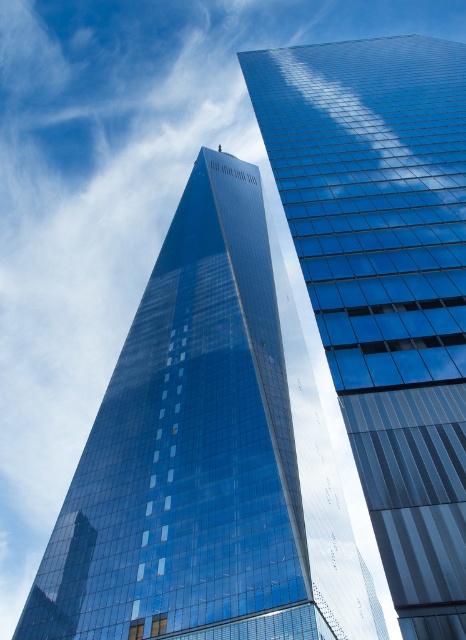
You are an architect reviewing a cityscape design. You notice two buildings labeled as the glossy glass tower at center and the glossy glass skyscraper at center. According to the design, which building appears lower in the image?

The glossy glass tower at center is located below the glossy glass skyscraper at center, so the glossy glass tower at center appears lower in the image.

You are an architect evaluating the two buildings in the image. Which of the two, the glossy glass tower at center or the glossy glass skyscraper at center, has a greater height?

The glossy glass tower at center is taller than the glossy glass skyscraper at center.